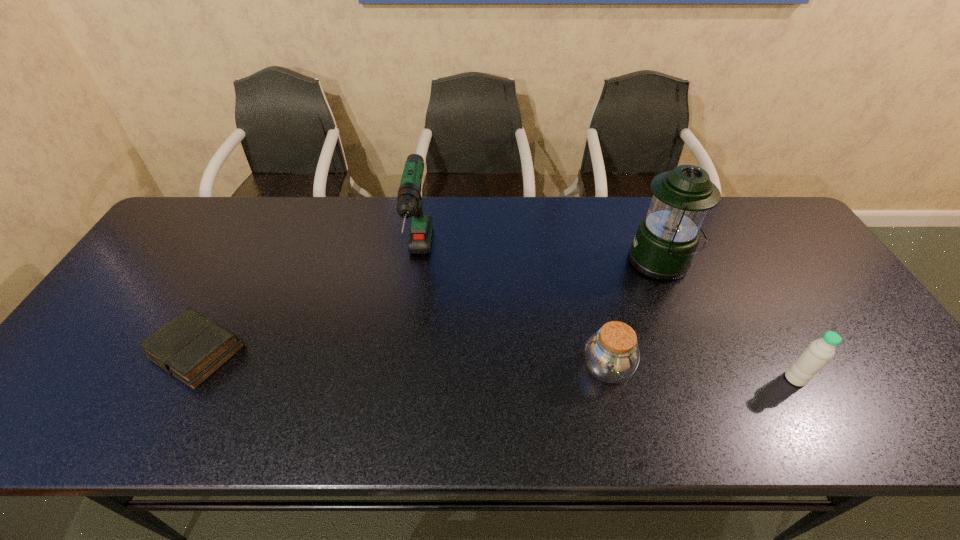
Where is `object that stands as the second closest to the fourth tallest object`? This screenshot has height=540, width=960. object that stands as the second closest to the fourth tallest object is located at coordinates pyautogui.click(x=819, y=352).

Identify the location of object that is the second closest to the leftmost object. The height and width of the screenshot is (540, 960). (612, 355).

Where is `vacant area in the image that satisfies the following two spatial constraints: 1. on the back side of the lantern; 2. on the right side of the jar`? Image resolution: width=960 pixels, height=540 pixels. vacant area in the image that satisfies the following two spatial constraints: 1. on the back side of the lantern; 2. on the right side of the jar is located at coordinates (582, 262).

Where is `free space that satisfies the following two spatial constraints: 1. on the handle side of the drill; 2. on the left side of the second shortest object`? The width and height of the screenshot is (960, 540). free space that satisfies the following two spatial constraints: 1. on the handle side of the drill; 2. on the left side of the second shortest object is located at coordinates (403, 368).

Identify the location of free space that satisfies the following two spatial constraints: 1. on the front side of the book; 2. on the left side of the second shortest object. The width and height of the screenshot is (960, 540). 187,368.

This screenshot has width=960, height=540. Find the location of `blank area in the image that satisfies the following two spatial constraints: 1. on the handle side of the water bottle; 2. on the left side of the fourth object from right to left`. blank area in the image that satisfies the following two spatial constraints: 1. on the handle side of the water bottle; 2. on the left side of the fourth object from right to left is located at coordinates (402, 379).